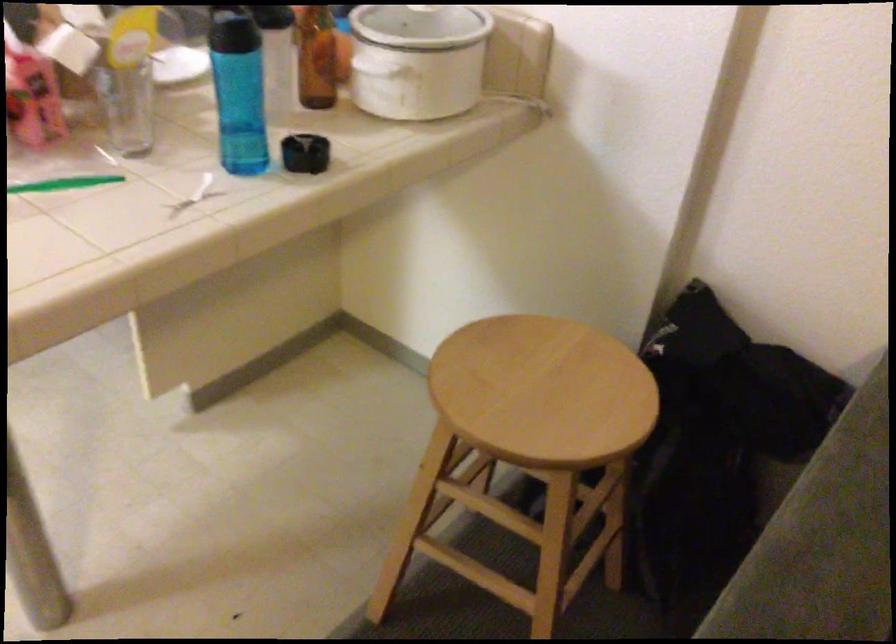
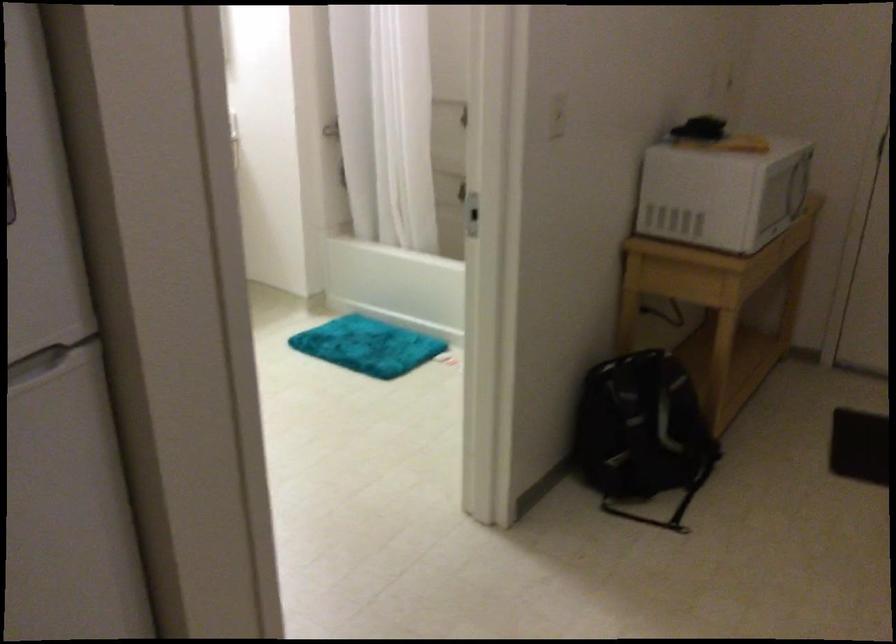
Question: The camera is either moving clockwise (left) or counter-clockwise (right) around the object. The first image is from the beginning of the video and the second image is from the end. Is the camera moving left or right when shooting the video?

Choices:
 (A) Left
 (B) Right

Answer: (B)